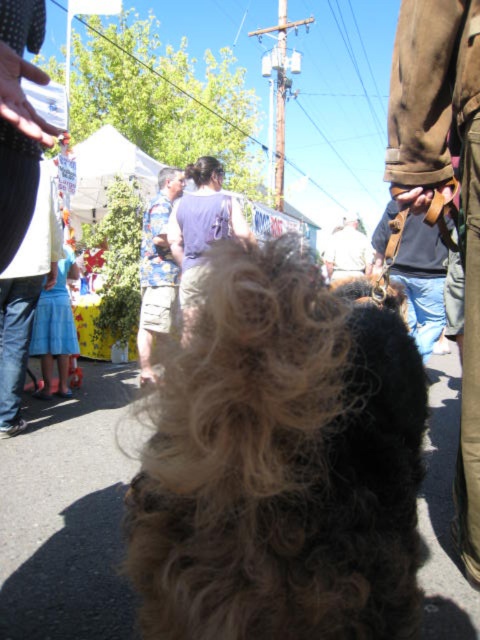
Question: Does brown leather belt at upper right have a lesser width compared to floral shirt at center?

Choices:
 (A) no
 (B) yes

Answer: (B)

Question: Which point is farther from the camera taking this photo?

Choices:
 (A) (49, 243)
 (B) (154, 241)
 (C) (342, 272)
 (D) (215, 216)

Answer: (C)

Question: Observing the image, what is the correct spatial positioning of curly fur dog at center in reference to brown leather belt at center?

Choices:
 (A) left
 (B) right

Answer: (A)

Question: Can you confirm if curly fur dog at center is bigger than dark purple shirt at center?

Choices:
 (A) yes
 (B) no

Answer: (B)

Question: Based on their relative distances, which object is farther from the curly fur dog at center?

Choices:
 (A) brown leather belt at upper right
 (B) light brown fur at center
 (C) brown leather belt at center

Answer: (B)

Question: Among these points, which one is nearest to the camera?

Choices:
 (A) (470, 33)
 (B) (351, 259)

Answer: (A)